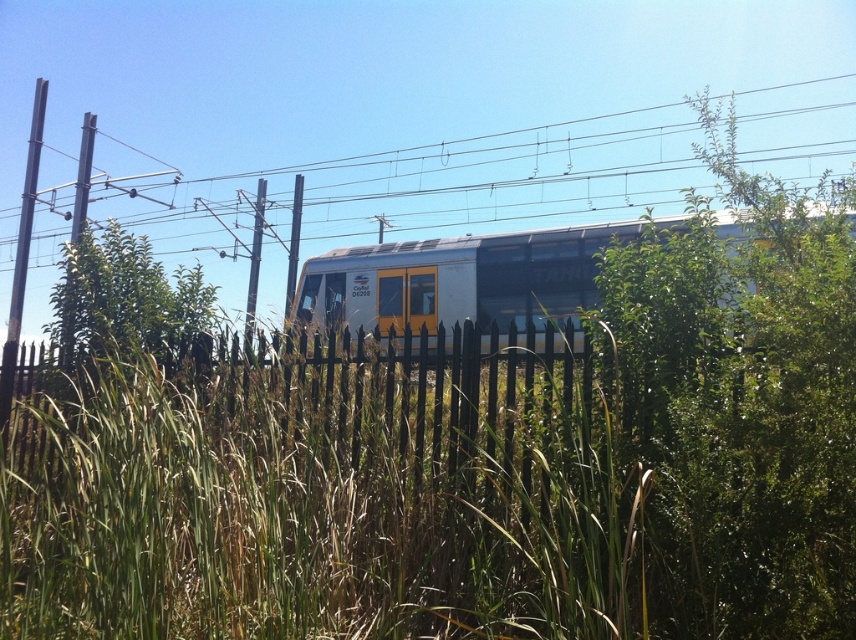
What is the coordinate of the green leafy tree at center?

The green leafy tree at center is located at coordinate point (123, 296).

You are a passenger on the silver metallic train at center. Looking out the window, you notice a green leafy tree at center. Is the tree closer to you or further away than the train?

The green leafy tree at center is behind the silver metallic train at center, so it is further away from you than the train.